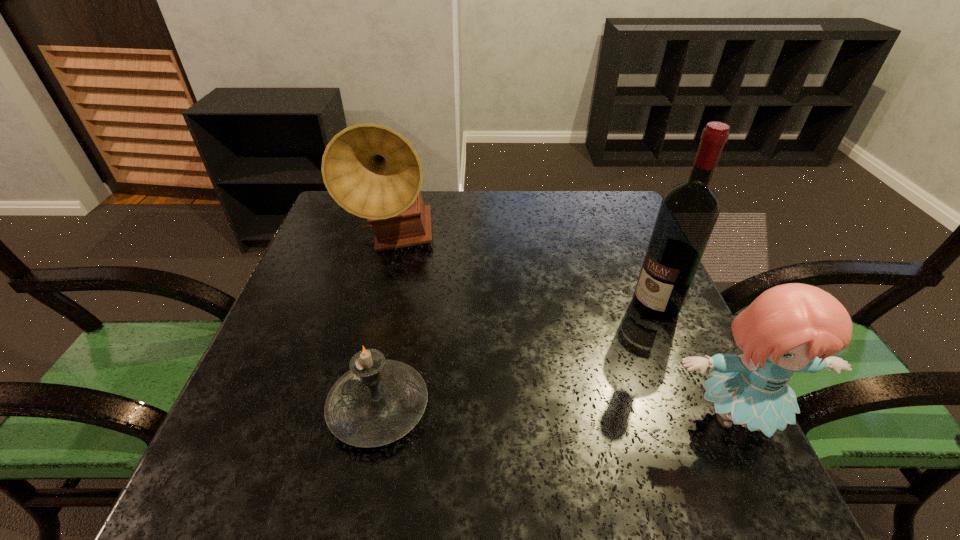
Find the location of a particular element. free space that is in between the third tallest object and the candle is located at coordinates (557, 413).

Where is `vacant region between the alcohol and the phonograph record`? vacant region between the alcohol and the phonograph record is located at coordinates (525, 274).

You are a GUI agent. You are given a task and a screenshot of the screen. Output one action in this format:
    pyautogui.click(x=<x>, y=<y>)
    Task: Click on the empty space between the third nearest object and the shortest object
    This screenshot has width=960, height=540.
    Given the screenshot: What is the action you would take?
    pyautogui.click(x=517, y=357)

Locate an element on the screen. free space between the alcohol and the shortest object is located at coordinates click(x=517, y=357).

The image size is (960, 540). Find the location of `free point between the phonograph record and the third tallest object`. free point between the phonograph record and the third tallest object is located at coordinates (564, 330).

This screenshot has width=960, height=540. In order to click on object identified as the closest to the phonograph record in this screenshot , I will do `click(378, 401)`.

The width and height of the screenshot is (960, 540). Find the location of `the third closest object to the third shortest object`. the third closest object to the third shortest object is located at coordinates (794, 327).

Locate an element on the screen. Image resolution: width=960 pixels, height=540 pixels. free space that satisfies the following two spatial constraints: 1. on the back side of the candle; 2. on the right side of the third nearest object is located at coordinates (398, 306).

At what (x,y) coordinates should I click in order to perform the action: click on blank space that satisfies the following two spatial constraints: 1. on the front side of the second tallest object; 2. on the left side of the second farthest object. Please return your answer as a coordinate pair (x, y). Looking at the image, I should click on (379, 306).

Where is `blank area in the image that satisfies the following two spatial constraints: 1. on the front side of the shortest object; 2. on the right side of the second tallest object`? This screenshot has height=540, width=960. blank area in the image that satisfies the following two spatial constraints: 1. on the front side of the shortest object; 2. on the right side of the second tallest object is located at coordinates (354, 408).